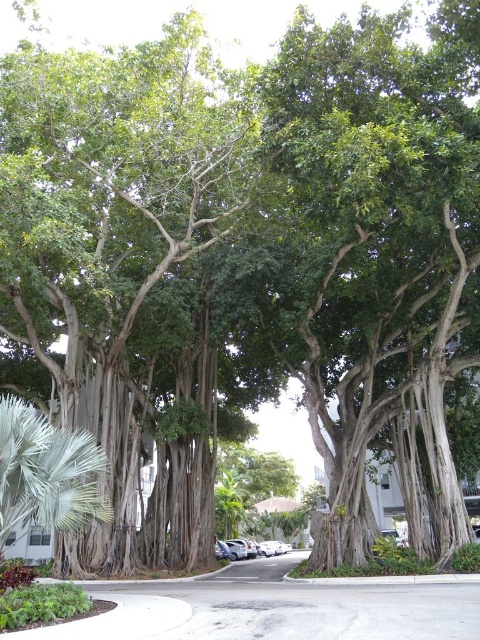
You are standing at the intersection of the sidewalk and the street. You want to walk straight ahead towards the green leafy banyan tree at center. Will you have to walk on the sidewalk or the street to reach it?

Since the green leafy banyan tree at center is located at point (380,257), which is closer to the sidewalk, you should walk on the sidewalk to reach it.

You are a driver trying to park your car in the street. You see the green leafy banyan tree at center and the silver metallic car at center. Which object takes up more space in the scene?

The green leafy banyan tree at center has a larger size compared to the silver metallic car at center, so it takes up more space in the scene.

You are a delivery person trying to navigate a narrow alley between the green leafy banyan tree at center and the silver metallic car at center. The alley is only 2 meters tall. Can your 2.5 meter tall delivery truck pass through without hitting anything?

The green leafy banyan tree at center is much taller than the silver metallic car at center. Since the alley is only 2 meters tall and the delivery truck is 2.5 meters tall, the truck cannot pass through without hitting the tree.